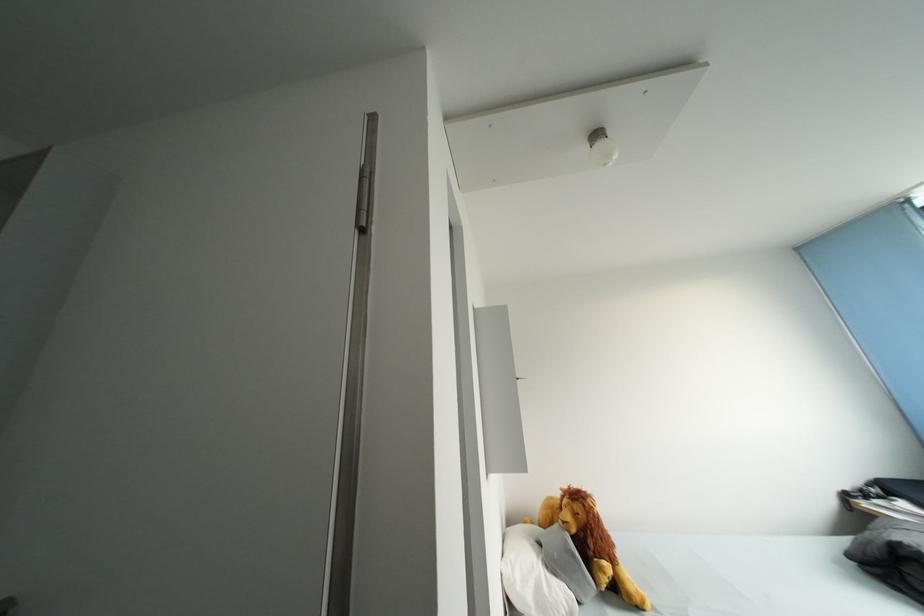
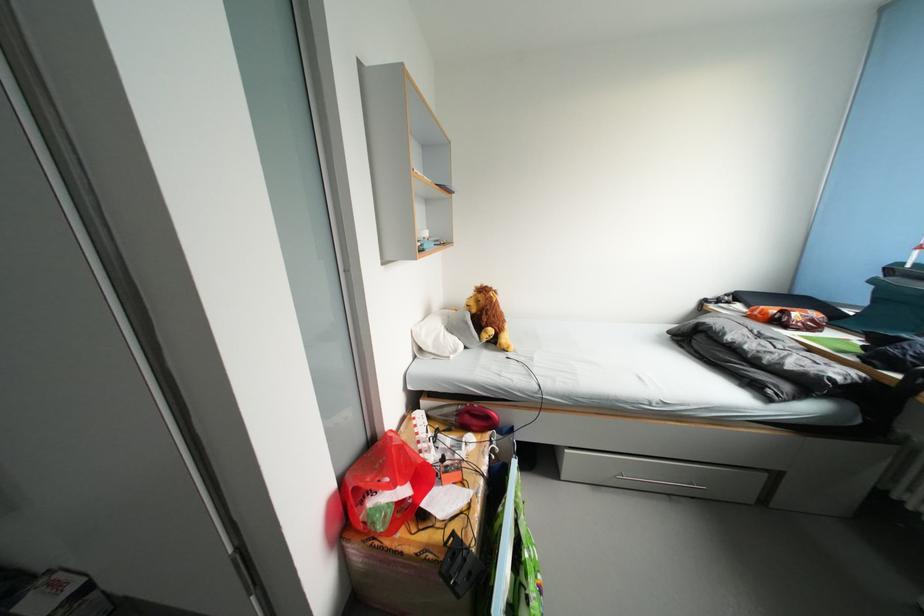
Find the pixel in the second image that matches point (581, 536) in the first image.

(482, 315)